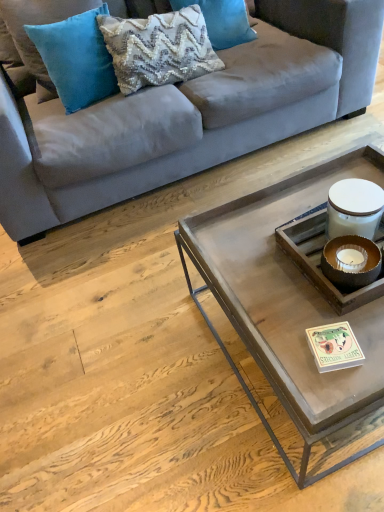
Question: From the image's perspective, is suede gray couch at upper center located above woven fabric pillow at upper center, the 3th pillow viewed from the left?

Choices:
 (A) yes
 (B) no

Answer: (B)

Question: Would you say suede gray couch at upper center is outside woven fabric pillow at upper center, the first pillow in the right-to-left sequence?

Choices:
 (A) yes
 (B) no

Answer: (A)

Question: Is the position of suede gray couch at upper center less distant than that of woven fabric pillow at upper center, the first pillow in the right-to-left sequence?

Choices:
 (A) no
 (B) yes

Answer: (B)

Question: Does suede gray couch at upper center appear on the left side of woven fabric pillow at upper center, the first pillow in the right-to-left sequence?

Choices:
 (A) no
 (B) yes

Answer: (B)

Question: Is the depth of suede gray couch at upper center greater than that of woven fabric pillow at upper center, the first pillow in the right-to-left sequence?

Choices:
 (A) yes
 (B) no

Answer: (B)

Question: Is textured cream pillow at upper center, which is the second pillow from right to left, spatially inside metallic gray tray at center, or outside of it?

Choices:
 (A) outside
 (B) inside

Answer: (A)

Question: In terms of height, does textured cream pillow at upper center, which is the second pillow from right to left, look taller or shorter compared to metallic gray tray at center?

Choices:
 (A) tall
 (B) short

Answer: (B)

Question: From a real-world perspective, is textured cream pillow at upper center, which is the second pillow from right to left, above or below metallic gray tray at center?

Choices:
 (A) below
 (B) above

Answer: (B)

Question: From the image's perspective, is textured cream pillow at upper center, the 2th pillow positioned from the left, above or below metallic gray tray at center?

Choices:
 (A) above
 (B) below

Answer: (A)

Question: In the image, is teal velvet pillow at upper left, which is the 1th pillow from left to right, on the left side or the right side of metallic gray tray at center?

Choices:
 (A) right
 (B) left

Answer: (B)

Question: Considering the positions of teal velvet pillow at upper left, which is the 1th pillow from left to right, and metallic gray tray at center in the image, is teal velvet pillow at upper left, which is the 1th pillow from left to right, taller or shorter than metallic gray tray at center?

Choices:
 (A) tall
 (B) short

Answer: (A)

Question: Based on their sizes in the image, would you say teal velvet pillow at upper left, which is the 1th pillow from left to right, is bigger or smaller than metallic gray tray at center?

Choices:
 (A) big
 (B) small

Answer: (B)

Question: Considering the positions of point (36, 32) and point (251, 318), is point (36, 32) closer or farther from the camera than point (251, 318)?

Choices:
 (A) farther
 (B) closer

Answer: (A)

Question: Is woven fabric pillow at upper center, the first pillow in the right-to-left sequence, inside or outside of suede gray couch at upper center?

Choices:
 (A) outside
 (B) inside

Answer: (B)

Question: From a real-world perspective, relative to suede gray couch at upper center, is woven fabric pillow at upper center, the first pillow in the right-to-left sequence, vertically above or below?

Choices:
 (A) below
 (B) above

Answer: (B)